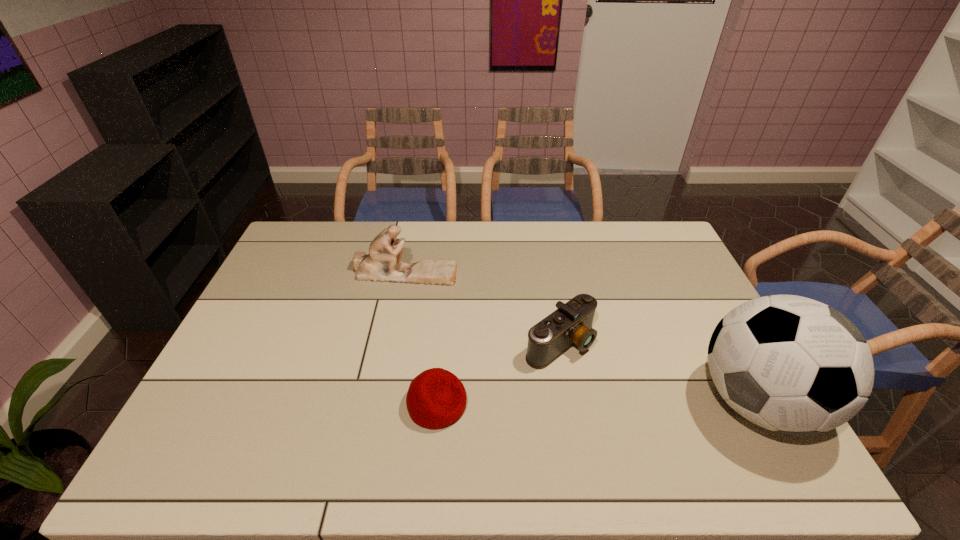
In order to click on free point between the beanbag and the third shortest object in this screenshot , I will do `click(420, 339)`.

Select which object appears as the closest to the third shortest object. Please provide its 2D coordinates. Your answer should be formatted as a tuple, i.e. [(x, y)], where the tuple contains the x and y coordinates of a point satisfying the conditions above.

[(571, 323)]

Locate which object is the closest to the beanbag. Please provide its 2D coordinates. Your answer should be formatted as a tuple, i.e. [(x, y)], where the tuple contains the x and y coordinates of a point satisfying the conditions above.

[(571, 323)]

The height and width of the screenshot is (540, 960). I want to click on free space that satisfies the following two spatial constraints: 1. on the front side of the soccer ball; 2. on the main logo of the figurine, so click(x=378, y=402).

Locate an element on the screen. The image size is (960, 540). free space that satisfies the following two spatial constraints: 1. on the front side of the beanbag; 2. on the seat area of the second tallest object is located at coordinates pos(378,404).

Locate an element on the screen. vacant space that satisfies the following two spatial constraints: 1. on the front side of the tallest object; 2. on the main logo of the figurine is located at coordinates (378, 402).